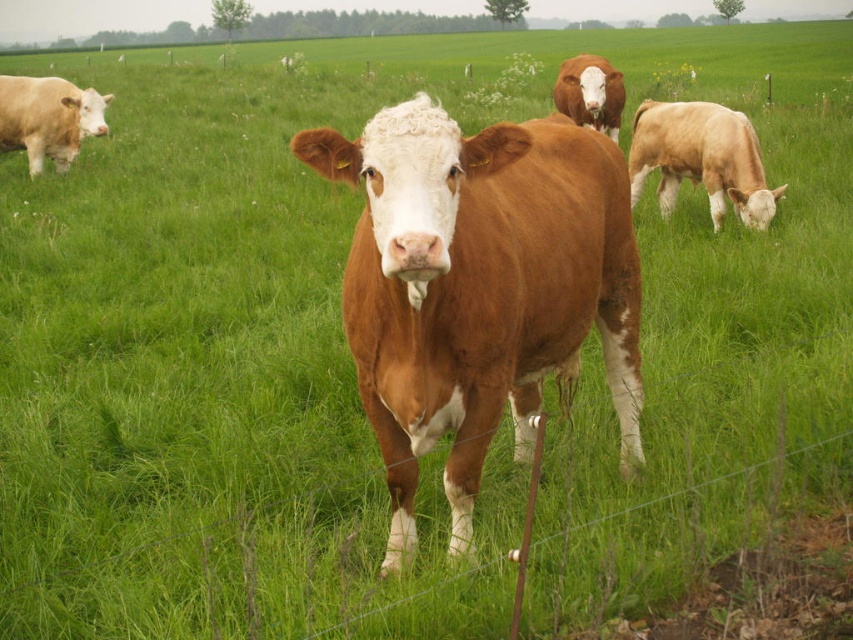
Locate an element on the screen. light brown smooth cow at right is located at coordinates (701, 157).

Does light brown smooth cow at right come in front of matte white cow at left?

Yes.

Between point (688, 129) and point (38, 122), which one is positioned behind?

Positioned behind is point (38, 122).

Find the location of a particular element. This screenshot has height=640, width=853. light brown smooth cow at right is located at coordinates (701, 157).

Does light brown smooth cow at right appear over brown matte cow at upper center?

Actually, light brown smooth cow at right is below brown matte cow at upper center.

Which of these two, light brown smooth cow at right or brown matte cow at upper center, stands taller?

Standing taller between the two is light brown smooth cow at right.

The image size is (853, 640). Identify the location of light brown smooth cow at right. (701, 157).

Is brown smooth cow at center above brown matte cow at upper center?

Incorrect, brown smooth cow at center is not positioned above brown matte cow at upper center.

Between brown smooth cow at center and brown matte cow at upper center, which one is positioned lower?

brown smooth cow at center is below.

Which is in front, point (451, 248) or point (602, 131)?

Point (451, 248) is in front.

The width and height of the screenshot is (853, 640). I want to click on brown smooth cow at center, so click(479, 288).